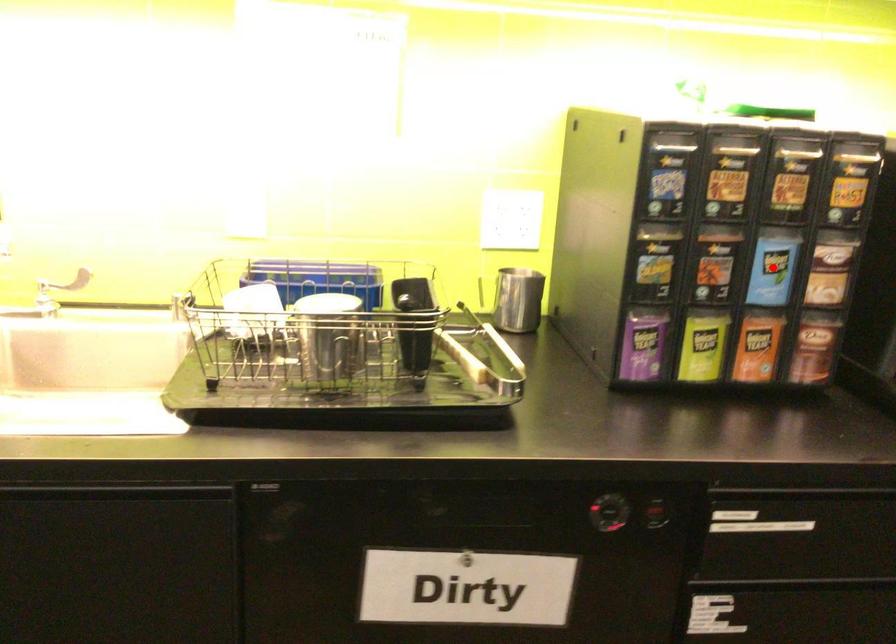
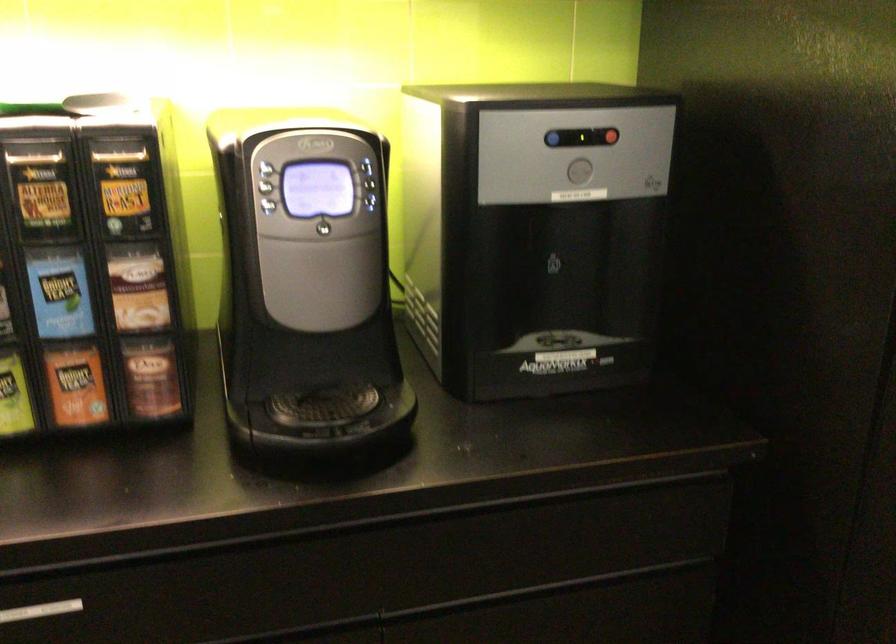
Question: I am providing you with two images of the same scene from different viewpoints. A red point is marked on the first image. At the location where the point appears in image 1, is it still visible in image 2?

Choices:
 (A) Yes
 (B) No

Answer: (A)